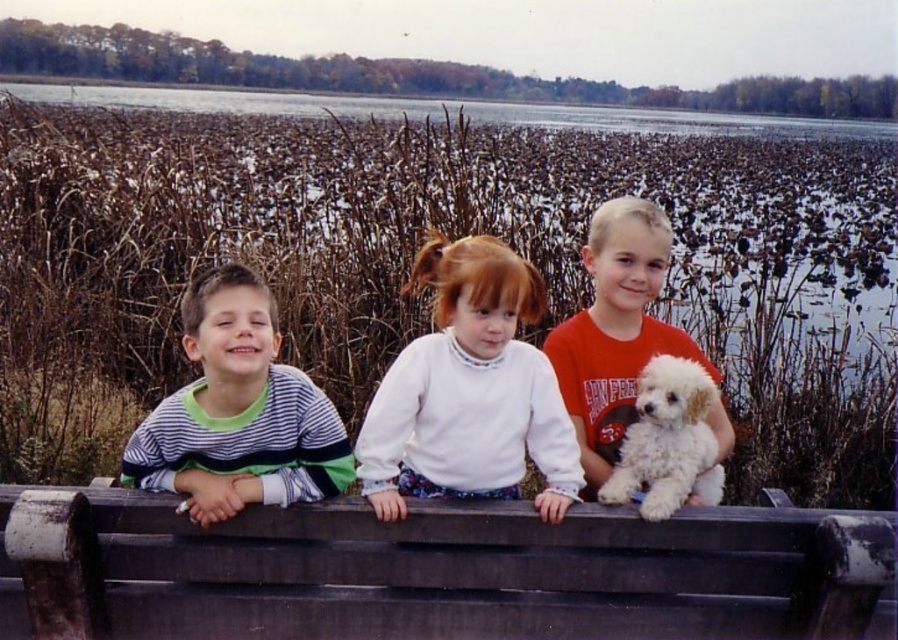
You are a photographer trying to capture the white fleece sweater at center and the clear water at upper center in a single frame. Since the camera can only focus on one object at a time, which object should you choose to ensure the smaller one is in focus?

The white fleece sweater at center has a smaller size compared to clear water at upper center, so you should focus on the white fleece sweater at center to ensure it is in focus since smaller objects often require closer focus.

You are a photographer setting up a tripod in the center of the scene. You need to place your equipment without blocking the view of the dark brown wooden park bench at center and the white fluffy dog at center. Based on their positions, which object is closer to the ground and should be considered for tripod placement?

The dark brown wooden park bench at center is positioned under white fluffy dog at center, meaning the bench is closer to the ground. Place the tripod near the bench to avoid blocking the dog above.